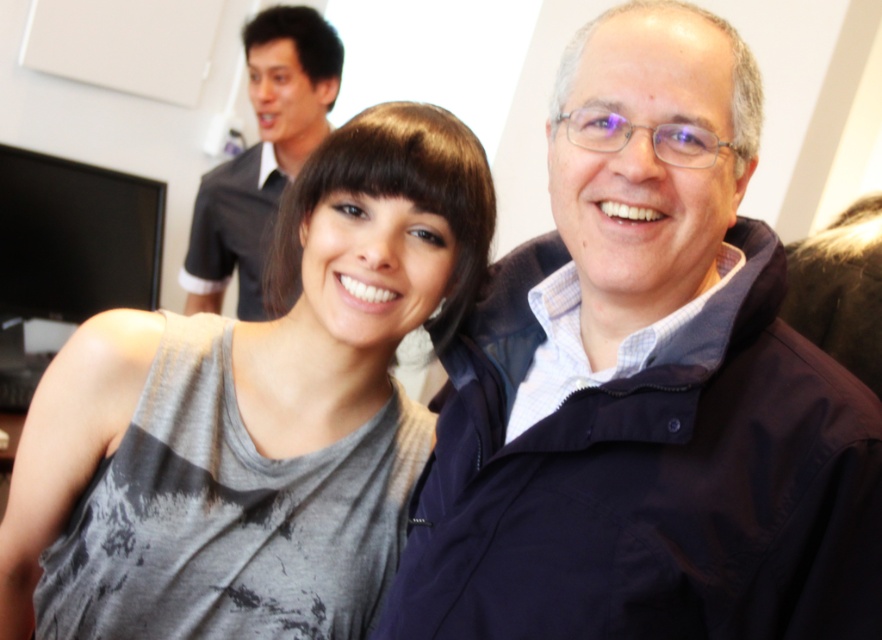
You are standing in the room and want to hand a document to the person wearing the navy blue jacket at center. Based on their position in the image, where should you walk to locate them?

The navy blue jacket at center is located at point 0.606 on the x axis and 0.732 on the y axis, so you should walk towards that coordinate to find them.

In the scene shown: You are taking a photo of the scene and want to ensure both the woman on the left and the man on the right are in focus. Given that your camera can only focus on objects at a specific distance from the camera, which of the two points, point [233,348] or point [283,48], is closer to the camera and should be prioritized for focus?

Point [233,348] is closer to the camera than point [283,48], so you should prioritize focusing on that point to ensure the woman on the left and the man on the right are in focus.